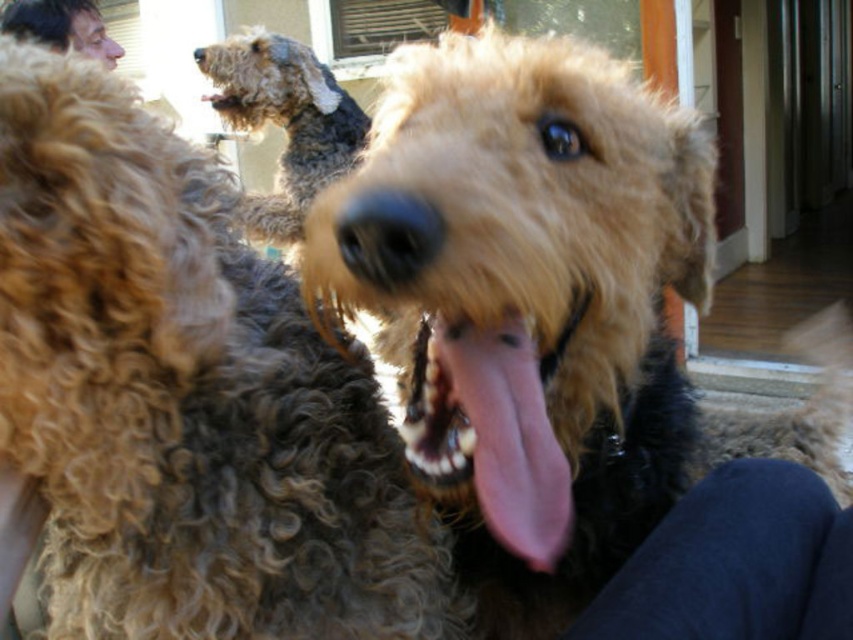
Question: Which point is closer to the camera?

Choices:
 (A) (138, 440)
 (B) (233, 106)
 (C) (285, 180)

Answer: (A)

Question: Estimate the real-world distances between objects in this image. Which object is closer to the fuzzy brown dog at center?

Choices:
 (A) smooth skin face at upper left
 (B) curly brown fur at upper left
 (C) brown curly fur at upper center
 (D) pink glossy tongue at center

Answer: (D)

Question: Is curly golden fur dog at center closer to the viewer compared to brown curly fur at upper center?

Choices:
 (A) no
 (B) yes

Answer: (B)

Question: Does fuzzy brown dog at center appear on the right side of curly brown fur at upper left?

Choices:
 (A) no
 (B) yes

Answer: (B)

Question: Which object appears farthest from the camera in this image?

Choices:
 (A) pink glossy tongue at center
 (B) curly brown fur at upper left
 (C) fuzzy brown dog at center

Answer: (B)

Question: Can you confirm if pink glossy tongue at center is positioned to the right of smooth skin face at upper left?

Choices:
 (A) no
 (B) yes

Answer: (B)